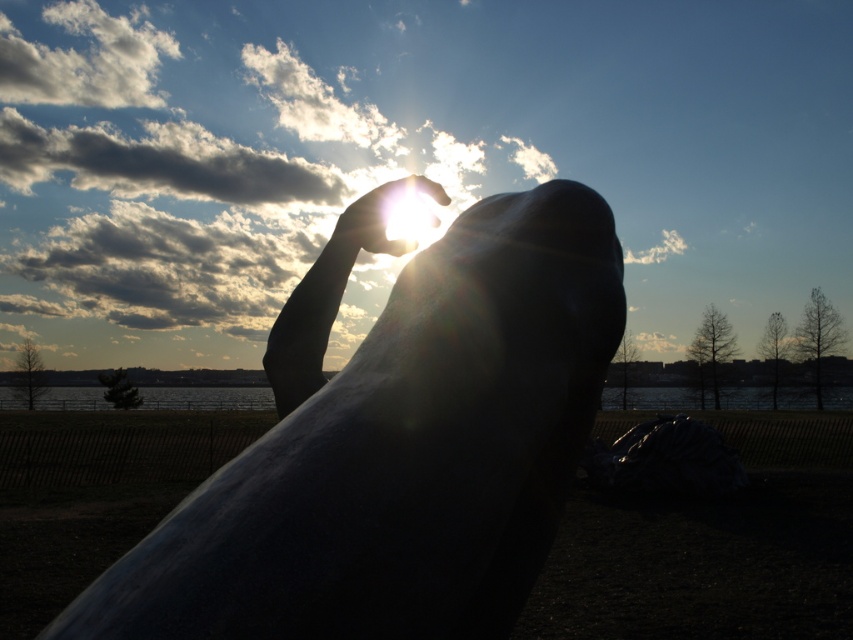
Question: Does satin silver statue at center appear on the left side of translucent glass hand at upper center?

Choices:
 (A) no
 (B) yes

Answer: (A)

Question: Is the position of satin silver statue at center less distant than that of translucent glass hand at upper center?

Choices:
 (A) yes
 (B) no

Answer: (A)

Question: Which point is closer to the camera?

Choices:
 (A) translucent glass hand at upper center
 (B) satin silver statue at center

Answer: (B)

Question: Can you confirm if satin silver statue at center is positioned above translucent glass hand at upper center?

Choices:
 (A) no
 (B) yes

Answer: (A)